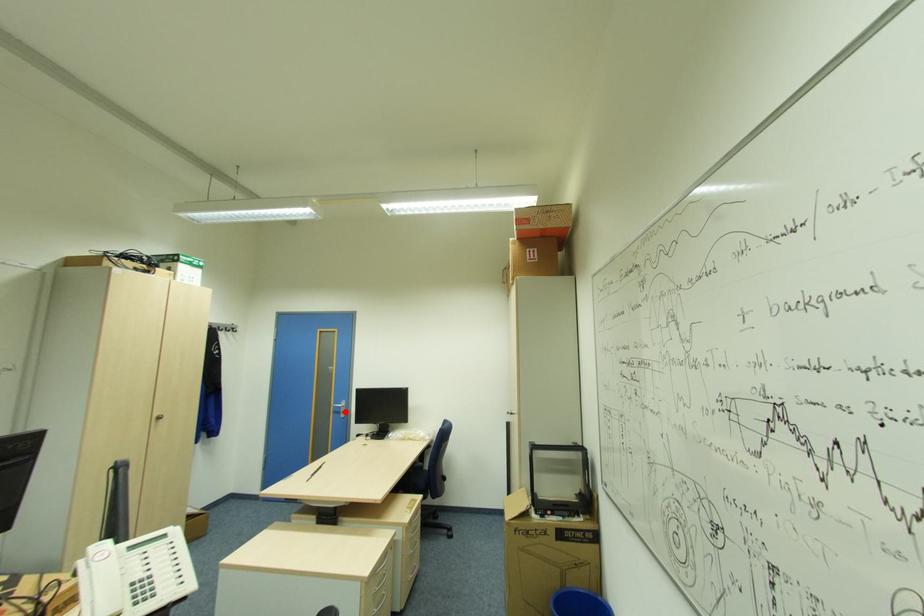
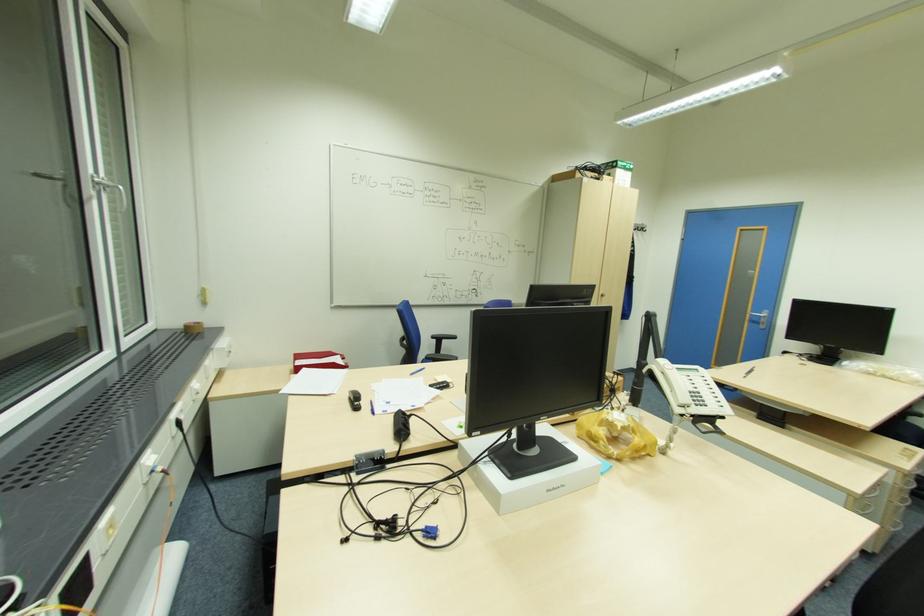
Find the pixel in the second image that matches the highlighted location in the first image.

(766, 323)